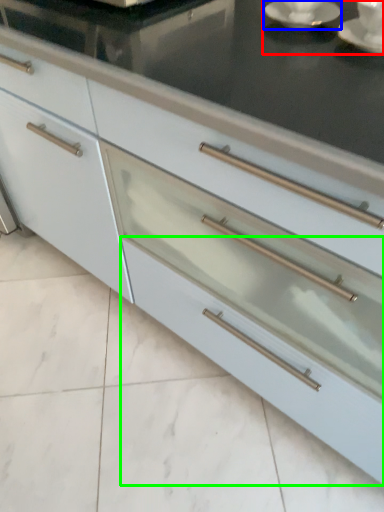
Question: Which object is positioned closest to tea set (highlighted by a red box)? Select from saucer (highlighted by a blue box) and drawer (highlighted by a green box).

Choices:
 (A) saucer
 (B) drawer

Answer: (A)